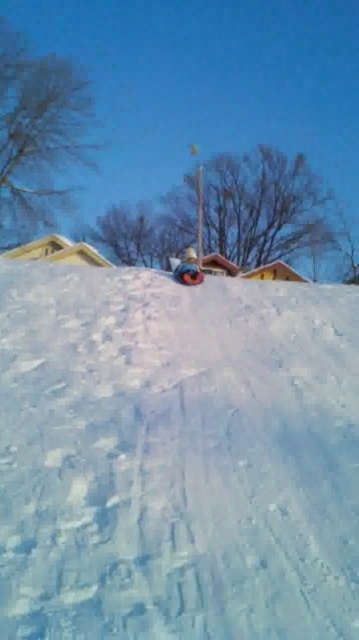
Question: Is white powdery snow at center thinner than matte blue snowboard at center?

Choices:
 (A) yes
 (B) no

Answer: (B)

Question: Is white powdery snow at center below matte blue snowboard at center?

Choices:
 (A) yes
 (B) no

Answer: (A)

Question: Does white powdery snow at center appear under matte blue snowboard at center?

Choices:
 (A) no
 (B) yes

Answer: (B)